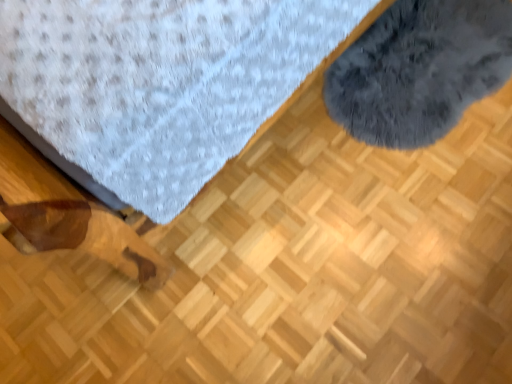
This screenshot has width=512, height=384. Describe the element at coordinates (420, 70) in the screenshot. I see `dark gray fluffy rug at upper right` at that location.

This screenshot has height=384, width=512. I want to click on dark gray fluffy rug at upper right, so click(x=420, y=70).

In order to click on dark gray fluffy rug at upper right in this screenshot , I will do `click(420, 70)`.